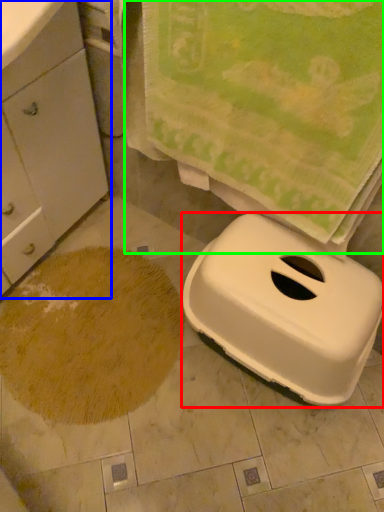
Question: Which object is positioned farthest from appliance (highlighted by a red box)? Select from cabinetry (highlighted by a blue box) and beach towel (highlighted by a green box).

Choices:
 (A) cabinetry
 (B) beach towel

Answer: (A)